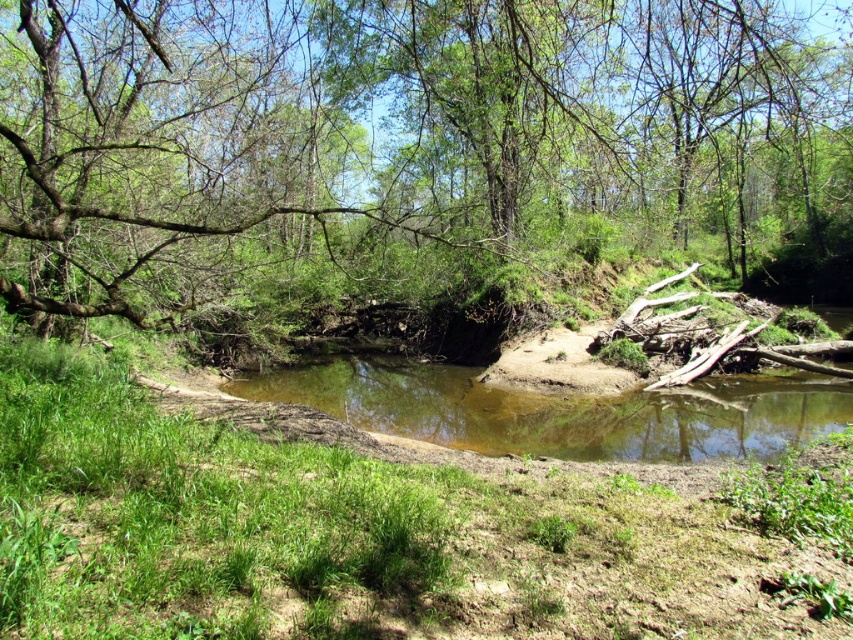
Question: Can you confirm if green leafy tree at center is positioned to the left of brown sandy river at center?

Choices:
 (A) no
 (B) yes

Answer: (A)

Question: Can you confirm if green leafy tree at center is wider than brown sandy river at center?

Choices:
 (A) no
 (B) yes

Answer: (B)

Question: Which of the following is the farthest from the observer?

Choices:
 (A) brown sandy river at center
 (B) green leafy tree at center

Answer: (A)

Question: Considering the relative positions of green leafy tree at center and brown sandy river at center in the image provided, where is green leafy tree at center located with respect to brown sandy river at center?

Choices:
 (A) right
 (B) left

Answer: (A)

Question: Which point appears closest to the camera in this image?

Choices:
 (A) (724, 102)
 (B) (838, 417)

Answer: (B)

Question: Which of the following is the farthest from the observer?

Choices:
 (A) green leafy tree at center
 (B) brown sandy river at center

Answer: (B)